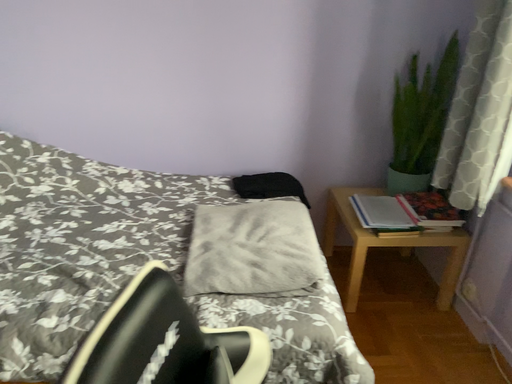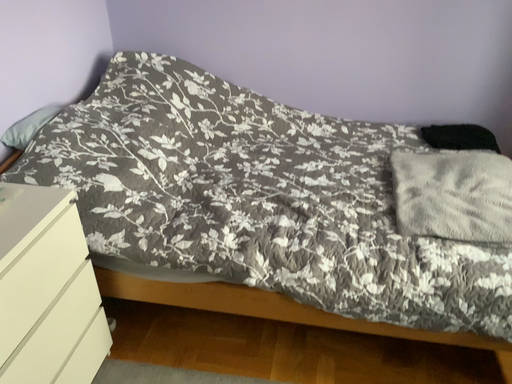
Question: How did the camera likely rotate when shooting the video?

Choices:
 (A) rotated right
 (B) rotated left

Answer: (B)